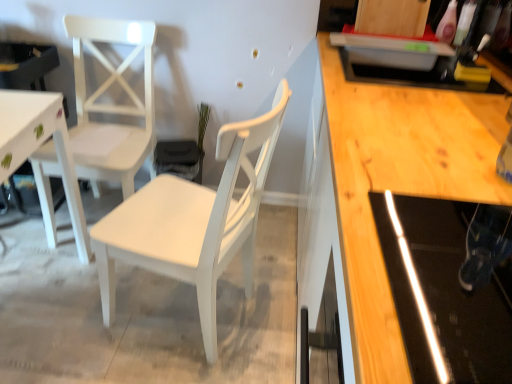
Find the location of a particular element. This screenshot has width=512, height=384. vacant space situated on the left part of white painted wood chair at center, positioned as the 1th chair in right-to-left order is located at coordinates (62, 312).